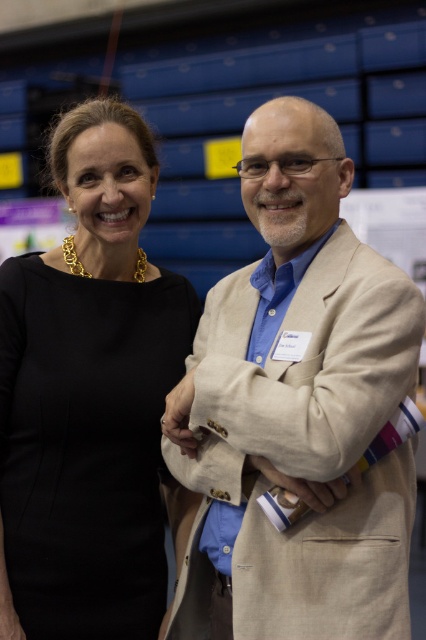
You are standing at the point marked as point (273, 349). You want to greet both the woman in the sleeveless black dress and the man in the light beige suit jacket. Which person is closer to you?

The woman in the sleeveless black dress is closer to you because they are 4.99 feet apart, so the distance between you and each of them would depend on their positions relative to the point. However, without exact coordinates for each individual, it is impossible to determine who is closer based solely on the provided information.

You are a photographer standing at a distance. You need to capture a closeup shot of the beige textured blazer at center without moving the subject. Can you do it with your current camera settings that have a maximum zoom of 4 feet?

The beige textured blazer at center is 4.36 feet away from the camera. Since the maximum zoom is 4 feet, the photographer cannot capture a closeup without moving closer or adjusting the settings.

You are standing at the origin point in the image. Which of the two points, point (353, 547) or point (161, 531), is closer to you?

Point (353, 547) is in front of point (161, 531), so it is closer to you.